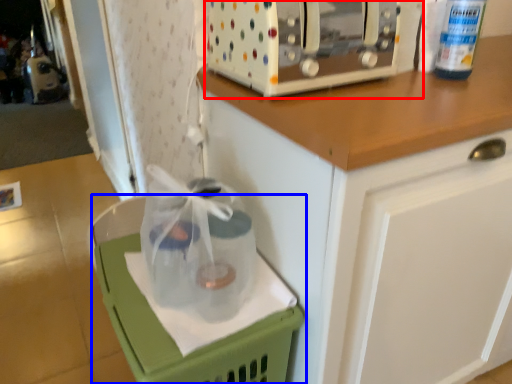
Question: Which object appears farthest to the camera in this image, home appliance (highlighted by a red box) or basket (highlighted by a blue box)?

Choices:
 (A) home appliance
 (B) basket

Answer: (A)